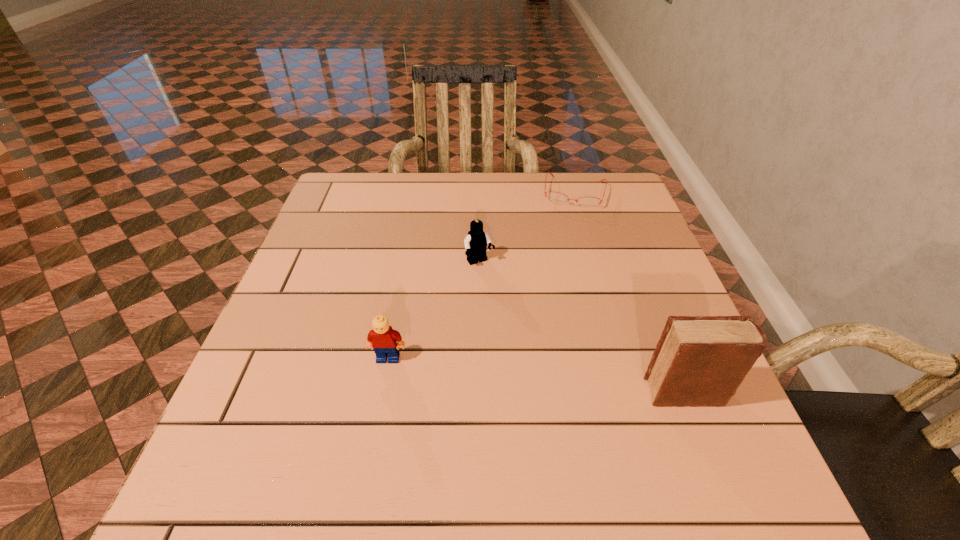
Locate which object ranks third in proximity to the shortest object. Please provide its 2D coordinates. Your answer should be formatted as a tuple, i.e. [(x, y)], where the tuple contains the x and y coordinates of a point satisfying the conditions above.

[(386, 342)]

The height and width of the screenshot is (540, 960). I want to click on vacant space that satisfies the following two spatial constraints: 1. on the front side of the third object from right to left; 2. on the spine side of the nearest object, so click(x=480, y=393).

Identify the location of free space that satisfies the following two spatial constraints: 1. on the front side of the farther Lego; 2. on the spine side of the diary. (480, 393).

Find the location of a particular element. The height and width of the screenshot is (540, 960). vacant space that satisfies the following two spatial constraints: 1. on the front side of the second farthest object; 2. on the spine side of the tallest object is located at coordinates click(480, 393).

Find the location of a particular element. This screenshot has width=960, height=540. vacant space that satisfies the following two spatial constraints: 1. on the front-facing side of the second nearest object; 2. on the spine side of the nearest object is located at coordinates (382, 393).

Where is `free space in the image that satisfies the following two spatial constraints: 1. on the front side of the right Lego; 2. on the spine side of the diary`? The image size is (960, 540). free space in the image that satisfies the following two spatial constraints: 1. on the front side of the right Lego; 2. on the spine side of the diary is located at coordinates (480, 393).

The height and width of the screenshot is (540, 960). What are the coordinates of `vacant area in the image that satisfies the following two spatial constraints: 1. on the front-facing side of the left Lego; 2. on the spine side of the nearest object` in the screenshot? It's located at (382, 393).